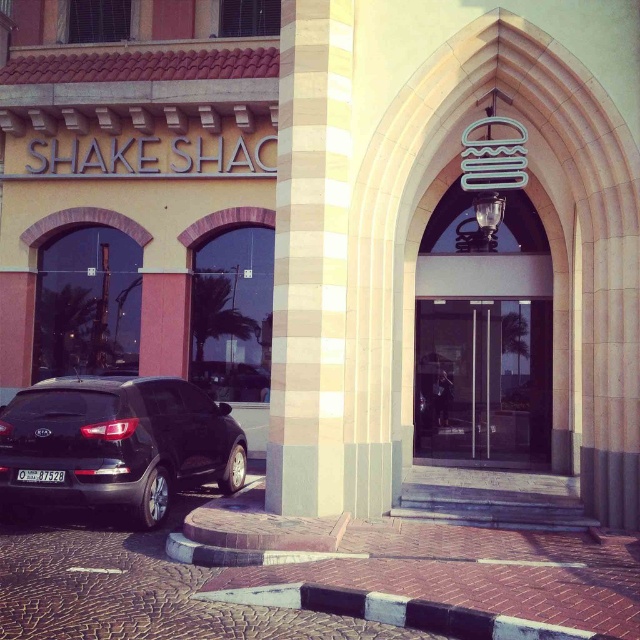
Is shiny black suv at lower left positioned behind transparent glass doors at center?

No, it is not.

Is point (150, 472) positioned before point (480, 346)?

Yes.

You are a GUI agent. You are given a task and a screenshot of the screen. Output one action in this format:
    pyautogui.click(x=<x>, y=<y>)
    Task: Click on the shiny black suv at lower left
    This screenshot has height=640, width=640.
    Given the screenshot: What is the action you would take?
    pyautogui.click(x=116, y=444)

Who is more distant from viewer, (316, 269) or (520, 410)?

Point (520, 410)

Does beige stone column at center have a greater height compared to transparent glass doors at center?

Indeed, beige stone column at center has a greater height compared to transparent glass doors at center.

Locate an element on the screen. beige stone column at center is located at coordinates (310, 259).

This screenshot has height=640, width=640. Identify the location of beige stone column at center. (310, 259).

Between point (284, 208) and point (164, 502), which one is positioned behind?

The point (164, 502) is more distant.

Is point (300, 330) closer to viewer compared to point (76, 499)?

No.

What do you see at coordinates (310, 259) in the screenshot? I see `beige stone column at center` at bounding box center [310, 259].

Where is `beige stone column at center`? Image resolution: width=640 pixels, height=640 pixels. beige stone column at center is located at coordinates 310,259.